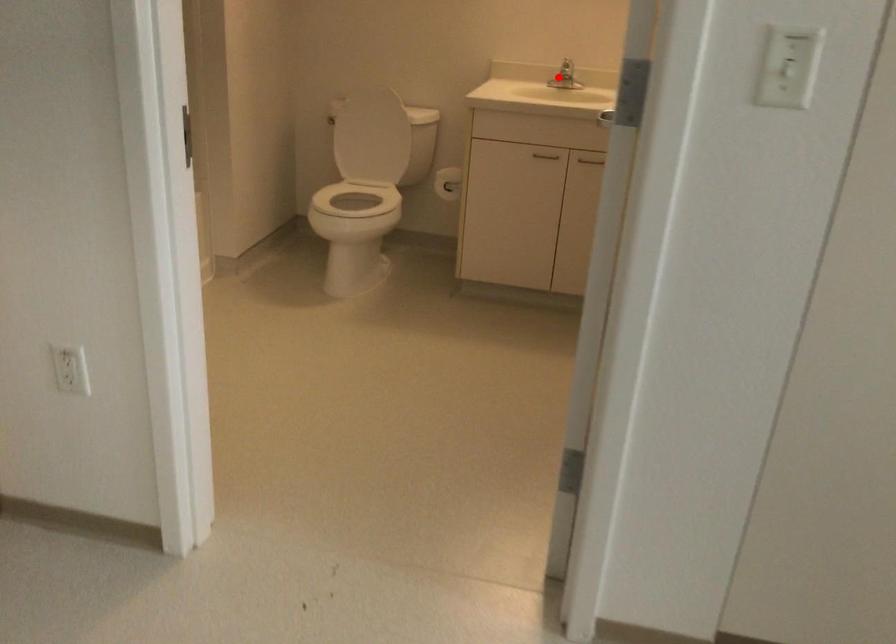
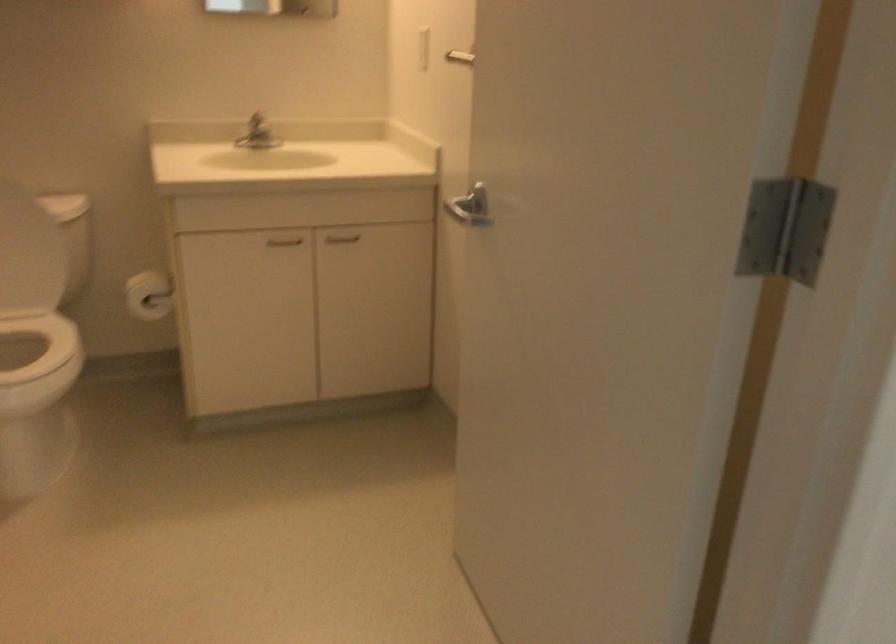
Locate, in the second image, the point that corresponds to the highlighted location in the first image.

(255, 133)